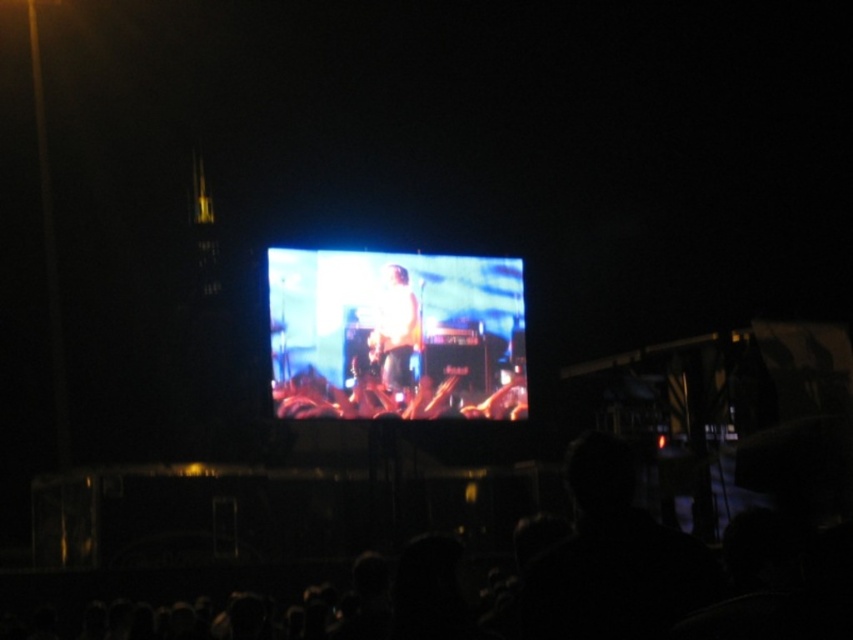
Question: Which of the following is the closest to the observer?

Choices:
 (A) shiny silver phone at center
 (B) white matte shirt at center

Answer: (A)

Question: Which point is farther to the camera?

Choices:
 (A) (274, 387)
 (B) (625, 467)
 (C) (399, 342)

Answer: (C)

Question: Where is shiny silver phone at center located in relation to white matte shirt at center in the image?

Choices:
 (A) below
 (B) above

Answer: (A)

Question: Which point appears farthest from the camera in this image?

Choices:
 (A) (334, 330)
 (B) (401, 332)

Answer: (B)

Question: Does shiny silver phone at center have a larger size compared to white matte shirt at center?

Choices:
 (A) yes
 (B) no

Answer: (A)

Question: Is black matte crowd at lower center positioned before white matte shirt at center?

Choices:
 (A) no
 (B) yes

Answer: (B)